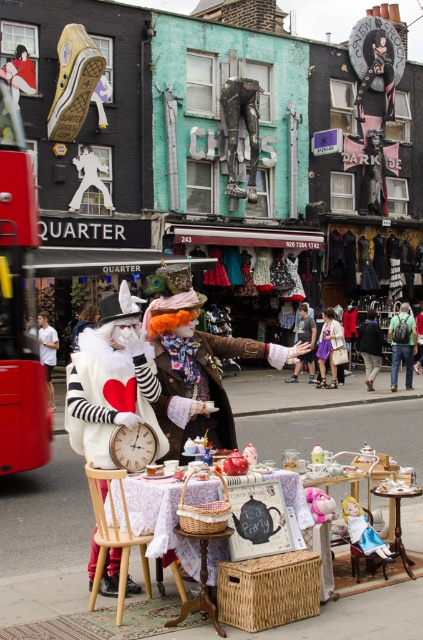
You are a street performer who wants to place a new prop between the wooden table at center and the pink plush unicorn at center. Based on their positions, which object should the prop be placed to the right of?

The wooden table at center is positioned on the left side of pink plush unicorn at center, so the prop should be placed to the right of the wooden table at center.

You are a street performer who needs to place your 1.2 meter tall prop on the wooden table at center. The prop is as tall as the matte brown leather jacket at center. Will the prop fit on the table without exceeding its height?

The wooden table at center is shorter than the matte brown leather jacket at center. Since the prop is as tall as the jacket, placing it on the table would cause the total height to exceed the table height, so it might not fit properly.

You are a street performer planning to set up a booth on this lively street. You have a wooden table at center and a pink plush unicorn at center. Which object has a greater width?

The wooden table at center has a greater width than the pink plush unicorn at center.